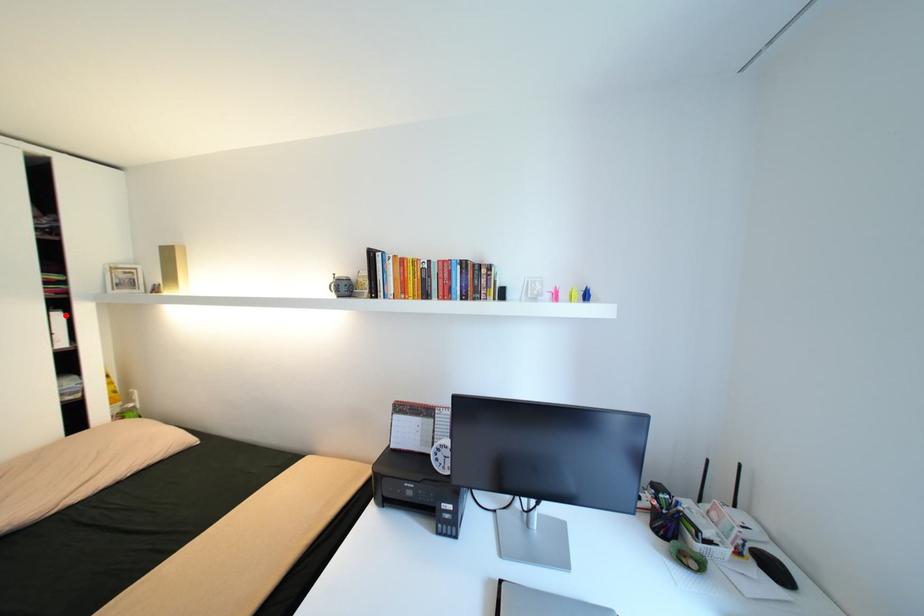
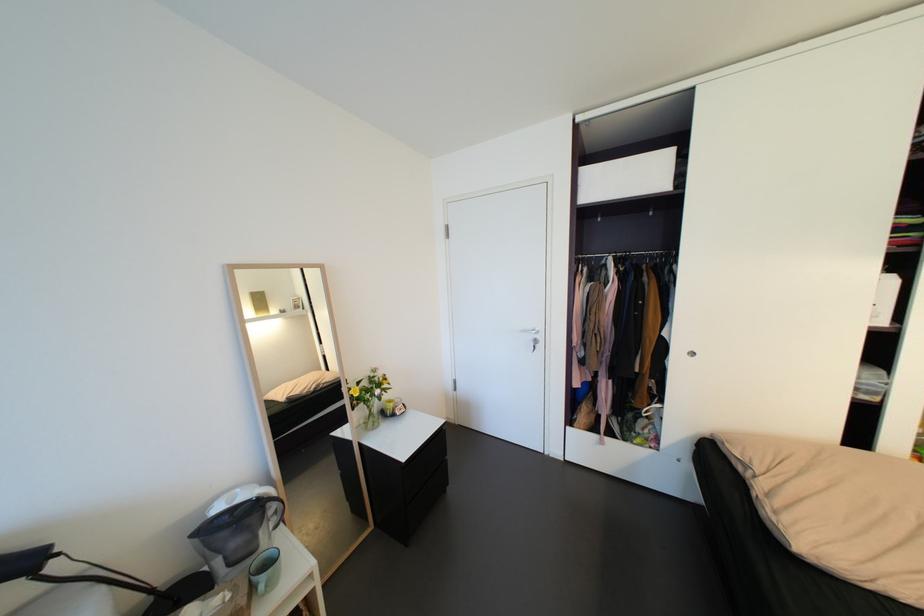
Find the pixel in the second image that matches the highlighted location in the first image.

(900, 278)